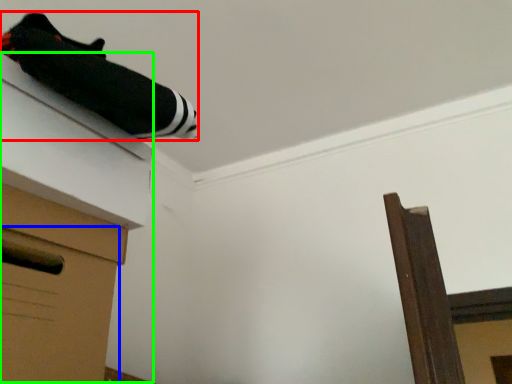
Question: Which object is the farthest from twin (highlighted by a red box)? Choose among these: drawer (highlighted by a blue box) or vanity (highlighted by a green box).

Choices:
 (A) drawer
 (B) vanity

Answer: (A)